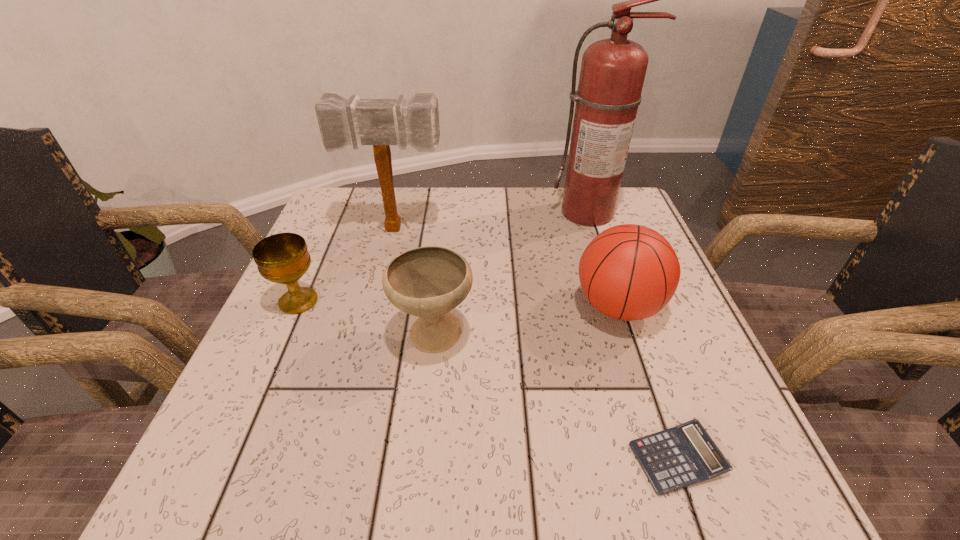
Identify the location of vacant space situated 0.080m on the left of the basketball. Image resolution: width=960 pixels, height=540 pixels. (533, 307).

Locate an element on the screen. The width and height of the screenshot is (960, 540). free space located on the back of the right chalice is located at coordinates (444, 233).

Identify the location of vacant region located on the back of the left chalice. This screenshot has width=960, height=540. (320, 253).

I want to click on free location located on the back of the nearest object, so click(612, 272).

Where is `fire extinguisher located in the far edge section of the desktop`? fire extinguisher located in the far edge section of the desktop is located at coordinates (612, 74).

In order to click on mallet at the far edge in this screenshot , I will do `click(379, 122)`.

Image resolution: width=960 pixels, height=540 pixels. I want to click on object positioned at the near edge, so click(684, 455).

The width and height of the screenshot is (960, 540). I want to click on mallet situated at the left edge, so click(x=379, y=122).

You are a GUI agent. You are given a task and a screenshot of the screen. Output one action in this format:
    pyautogui.click(x=<x>, y=<y>)
    Task: Click on the chalice that is at the left edge
    This screenshot has width=960, height=540.
    Given the screenshot: What is the action you would take?
    pyautogui.click(x=283, y=258)

Where is `fire extinguisher at the right edge`? Image resolution: width=960 pixels, height=540 pixels. fire extinguisher at the right edge is located at coordinates (612, 74).